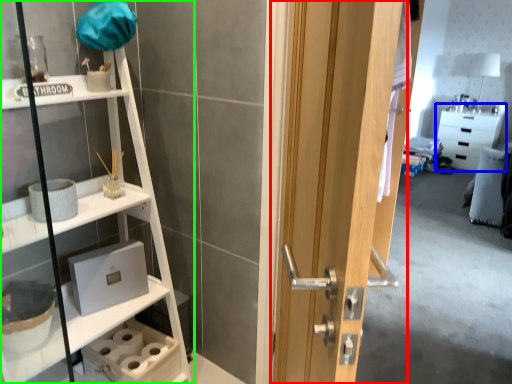
Question: Considering the real-world distances, which object is closest to door (highlighted by a red box)? cabinetry (highlighted by a blue box) or shelf (highlighted by a green box).

Choices:
 (A) cabinetry
 (B) shelf

Answer: (B)